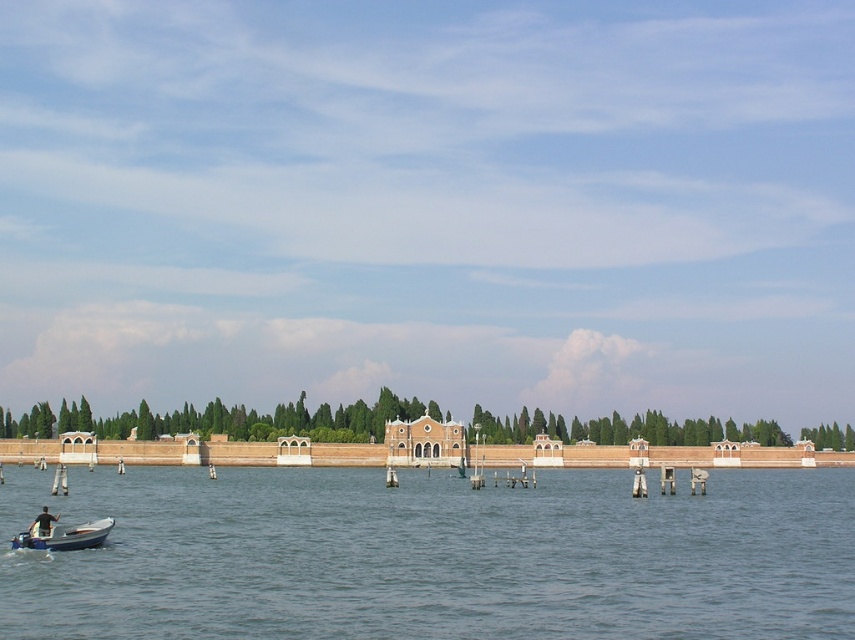
Between blue plastic boat at lower left and dark blue fabric at lower left, which one has more height?

With more height is dark blue fabric at lower left.

Which is behind, point (57, 524) or point (32, 524)?

The point (32, 524) is more distant.

Between point (87, 541) and point (46, 516), which one is positioned behind?

The point (87, 541) is behind.

Find the location of `blue plastic boat at lower left`. blue plastic boat at lower left is located at coordinates (63, 536).

Consider the image. Between clear water at lower left and dark blue fabric at lower left, which one has more height?

clear water at lower left

Is clear water at lower left closer to camera compared to dark blue fabric at lower left?

Yes, it is in front of dark blue fabric at lower left.

Does point (219, 621) come behind point (45, 528)?

No, it is in front of (45, 528).

Where is `clear water at lower left`? clear water at lower left is located at coordinates (433, 556).

Is point (753, 573) positioned after point (91, 534)?

No.

Can you confirm if clear water at lower left is shorter than blue plastic boat at lower left?

No.

Between point (414, 492) and point (34, 531), which one is positioned behind?

Point (414, 492)

Image resolution: width=855 pixels, height=640 pixels. I want to click on clear water at lower left, so click(x=433, y=556).